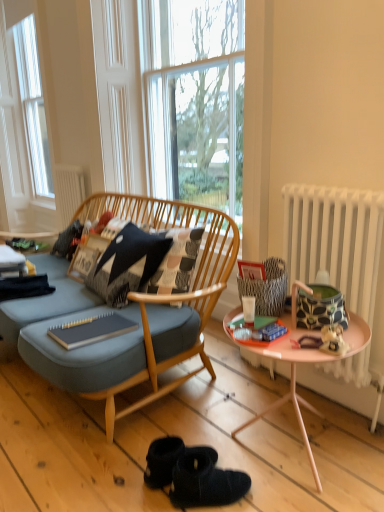
Measure the distance between white matte radiator at upper center, placed as the first radiator when sorted from back to front, and camera.

10.31 feet.

Locate an element on the screen. This screenshot has height=512, width=384. white matte radiator at upper center, marked as the 1th radiator in a top-to-bottom arrangement is located at coordinates (68, 192).

Measure the distance between black textured pillow at center and camera.

They are 6.60 feet apart.

I want to click on matte gray notebook at center, the first magazine viewed from the back, so click(x=91, y=330).

What do you see at coordinates (257, 331) in the screenshot? I see `matte green magazine at center, the second magazine when ordered from back to front` at bounding box center [257, 331].

The height and width of the screenshot is (512, 384). In order to click on pink wood table at lower right in this screenshot , I will do `click(291, 382)`.

Where is `white matte radiator at upper center, arranged as the 2th radiator when viewed from the right`? This screenshot has width=384, height=512. white matte radiator at upper center, arranged as the 2th radiator when viewed from the right is located at coordinates (68, 192).

Is clear glass window at center not close to matte green magazine at center, the second magazine in the left-to-right sequence?

clear glass window at center is far away from matte green magazine at center, the second magazine in the left-to-right sequence.

Is clear glass window at center closer to camera compared to matte green magazine at center, the 1th magazine in the right-to-left sequence?

No, clear glass window at center is further to the viewer.

Between point (227, 157) and point (285, 329), which one is positioned in front?

The point (285, 329) is closer to the camera.

Relative to white matte radiator at upper center, arranged as the 2th radiator when viewed from the right, is white glossy cup at center in front or behind?

white glossy cup at center is positioned closer to the viewer than white matte radiator at upper center, arranged as the 2th radiator when viewed from the right.

Is white glossy cup at center bigger than white matte radiator at upper center, placed as the first radiator when sorted from back to front?

Incorrect, white glossy cup at center is not larger than white matte radiator at upper center, placed as the first radiator when sorted from back to front.

From the picture: Could you tell me if white glossy cup at center is facing white matte radiator at upper center, which is the second radiator from front to back?

No, white glossy cup at center is not oriented towards white matte radiator at upper center, which is the second radiator from front to back.

Is white glossy cup at center thinner than white matte radiator at upper center, which is the second radiator from front to back?

Yes.

Does white radiator at right, the 2th radiator from the back, come in front of clear glass window at center?

Yes, white radiator at right, the 2th radiator from the back, is closer to the viewer.

Which is in front, point (347, 361) or point (205, 96)?

Point (347, 361)

From a real-world perspective, is white radiator at right, acting as the second radiator starting from the top, under clear glass window at center?

Yes, from a real-world perspective, white radiator at right, acting as the second radiator starting from the top, is beneath clear glass window at center.

Between white radiator at right, acting as the 1th radiator starting from the bottom, and clear glass window at center, which one has smaller size?

Smaller between the two is white radiator at right, acting as the 1th radiator starting from the bottom.

Based on their positions, is black suede booties at lower center located to the left or right of pink wood table at lower right?

In the image, black suede booties at lower center appears on the left side of pink wood table at lower right.

Is black suede booties at lower center directly adjacent to pink wood table at lower right?

black suede booties at lower center and pink wood table at lower right are not in contact.

Is black suede booties at lower center inside or outside of pink wood table at lower right?

black suede booties at lower center is not inside pink wood table at lower right, it's outside.

Where is `desk above the black suede booties at lower center (from the image's perspective)`? This screenshot has width=384, height=512. desk above the black suede booties at lower center (from the image's perspective) is located at coordinates (291, 382).

From a real-world perspective, does pink wood table at lower right sit lower than matte green magazine at center, the second magazine in the left-to-right sequence?

Yes, from a real-world perspective, pink wood table at lower right is below matte green magazine at center, the second magazine in the left-to-right sequence.

In the image, is pink wood table at lower right positioned in front of or behind matte green magazine at center, which ranks as the 1th magazine in front-to-back order?

Visually, pink wood table at lower right is located in front of matte green magazine at center, which ranks as the 1th magazine in front-to-back order.

Does pink wood table at lower right have a larger size compared to matte green magazine at center, the second magazine in the left-to-right sequence?

Yes.

Can we say clear glass window at center lies outside black textured pillow at center?

Yes.

Is point (169, 151) behind point (93, 271)?

Yes, point (169, 151) is behind point (93, 271).

Who is taller, clear glass window at center or black textured pillow at center?

With more height is clear glass window at center.

Are white matte radiator at upper center, the second radiator ordered from the bottom, and pink wood table at lower right making contact?

white matte radiator at upper center, the second radiator ordered from the bottom, is not next to pink wood table at lower right, and they're not touching.

Does point (61, 230) appear closer or farther from the camera than point (283, 404)?

Point (61, 230) is farther from the camera than point (283, 404).

Choose the correct answer: Is white matte radiator at upper center, the second radiator ordered from the bottom, inside pink wood table at lower right or outside it?

white matte radiator at upper center, the second radiator ordered from the bottom, exists outside the volume of pink wood table at lower right.

Identify the location of window positioned vertically above the matte green magazine at center, the second magazine when ordered from back to front (from a real-world perspective). Image resolution: width=384 pixels, height=512 pixels. tap(194, 100).

In order to click on radiator on the left of white glossy cup at center in this screenshot , I will do `click(68, 192)`.

From the picture: From the image, which object appears to be farther from matte green magazine at center, the 1th magazine in the right-to-left sequence, pink wood table at lower right or clear glass window at center?

Among the two, clear glass window at center is located further to matte green magazine at center, the 1th magazine in the right-to-left sequence.

Estimate the real-world distances between objects in this image. Which object is further from white matte radiator at upper center, placed as the first radiator when sorted from back to front, matte gray notebook at center, the second magazine in the front-to-back sequence, or pink wood table at lower right?

The object further to white matte radiator at upper center, placed as the first radiator when sorted from back to front, is pink wood table at lower right.

When comparing their distances from white matte radiator at upper center, arranged as the 2th radiator when viewed from the right, does black suede booties at lower center or white glossy cup at center seem further?

The object further to white matte radiator at upper center, arranged as the 2th radiator when viewed from the right, is black suede booties at lower center.

Which object lies nearer to the anchor point black textured pillow at center, pink wood table at lower right or matte gray notebook at center, placed as the 1th magazine when sorted from left to right?

Among the two, matte gray notebook at center, placed as the 1th magazine when sorted from left to right, is located nearer to black textured pillow at center.

From the picture: Based on their spatial positions, is white radiator at right, the 2th radiator from the back, or white glossy cup at center closer to matte gray notebook at center, placed as the 1th magazine when sorted from left to right?

Based on the image, white glossy cup at center appears to be nearer to matte gray notebook at center, placed as the 1th magazine when sorted from left to right.

When comparing their distances from pink wood table at lower right, does white glossy cup at center or white radiator at right, which is the first radiator in right-to-left order, seem further?

white radiator at right, which is the first radiator in right-to-left order.

Looking at the image, which one is located further to matte green magazine at center, the second magazine in the left-to-right sequence, white radiator at right, the 2th radiator from the left, or clear glass window at center?

clear glass window at center is further to matte green magazine at center, the second magazine in the left-to-right sequence.

Looking at the image, which one is located closer to black textured pillow at center, pink wood table at lower right or matte green magazine at center, the second magazine in the left-to-right sequence?

pink wood table at lower right is closer to black textured pillow at center.

Where is `magazine between clear glass window at center and matte gray notebook at center, the first magazine viewed from the back, in the vertical direction`? The image size is (384, 512). magazine between clear glass window at center and matte gray notebook at center, the first magazine viewed from the back, in the vertical direction is located at coordinates (257, 331).

The image size is (384, 512). I want to click on magazine between black suede booties at lower center and white matte radiator at upper center, placed as the first radiator when sorted from back to front, along the z-axis, so click(91, 330).

I want to click on magazine between matte gray notebook at center, the 2th magazine positioned from the right, and white radiator at right, acting as the 1th radiator starting from the bottom, in the horizontal direction, so click(x=257, y=331).

Image resolution: width=384 pixels, height=512 pixels. In order to click on desk between matte green magazine at center, the second magazine in the left-to-right sequence, and black suede booties at lower center in the up-down direction in this screenshot , I will do `click(291, 382)`.